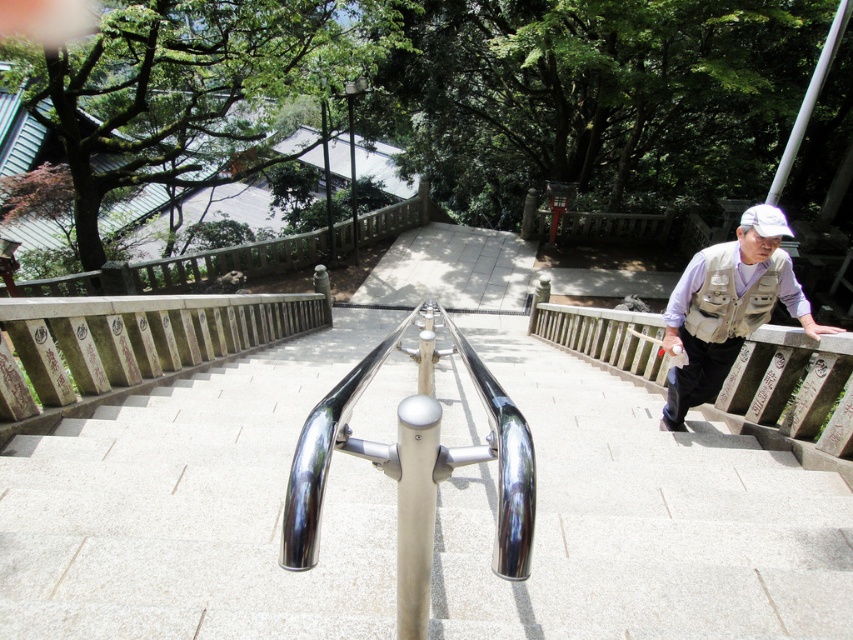
You are standing at the bottom of the staircase and want to reach the light brown vest at right without touching the polished metal handrail at center. Is there enough space between them to walk through?

The distance between the polished metal handrail at center and the light brown vest at right is 2.44 meters. Since this distance is greater than the typical width of a person, you can safely walk through without touching either object.

You are standing at the bottom of the staircase and want to place a small potted plant between the wooden at right and the white matte baseball hat at upper right. Which object should the plant be closer to based on their heights?

The wooden at right is shorter than the white matte baseball hat at upper right, so the plant should be placed closer to the wooden at right to maintain a balanced arrangement.